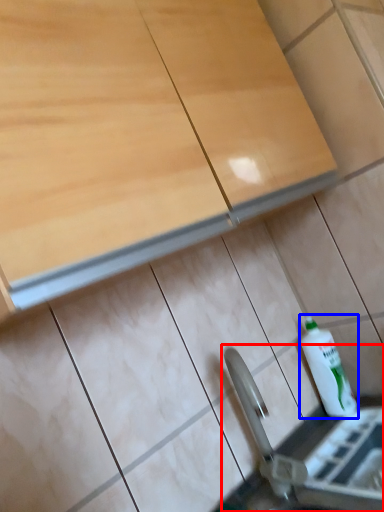
Question: Which of the following is the farthest to the observer, sink (highlighted by a red box) or bottle (highlighted by a blue box)?

Choices:
 (A) sink
 (B) bottle

Answer: (B)